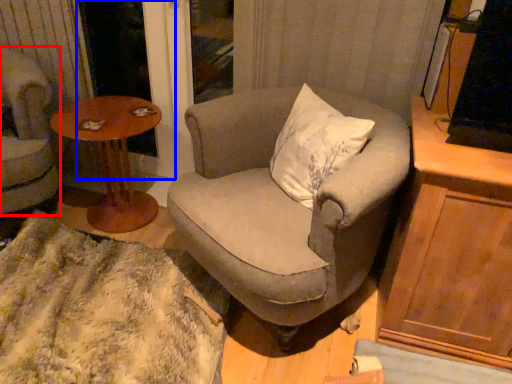
Question: Which object is closer to the camera taking this photo, chair (highlighted by a red box) or screen door (highlighted by a blue box)?

Choices:
 (A) chair
 (B) screen door

Answer: (A)